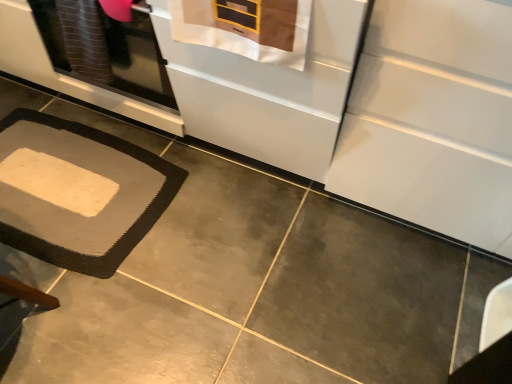
What do you see at coordinates (78, 192) in the screenshot? The height and width of the screenshot is (384, 512). I see `beige textured mat at lower left` at bounding box center [78, 192].

The width and height of the screenshot is (512, 384). In order to click on beige textured mat at lower left in this screenshot , I will do `click(78, 192)`.

You are a GUI agent. You are given a task and a screenshot of the screen. Output one action in this format:
    pyautogui.click(x=<x>, y=<y>)
    Task: Click on the beige textured mat at lower left
    
    Given the screenshot: What is the action you would take?
    pyautogui.click(x=78, y=192)